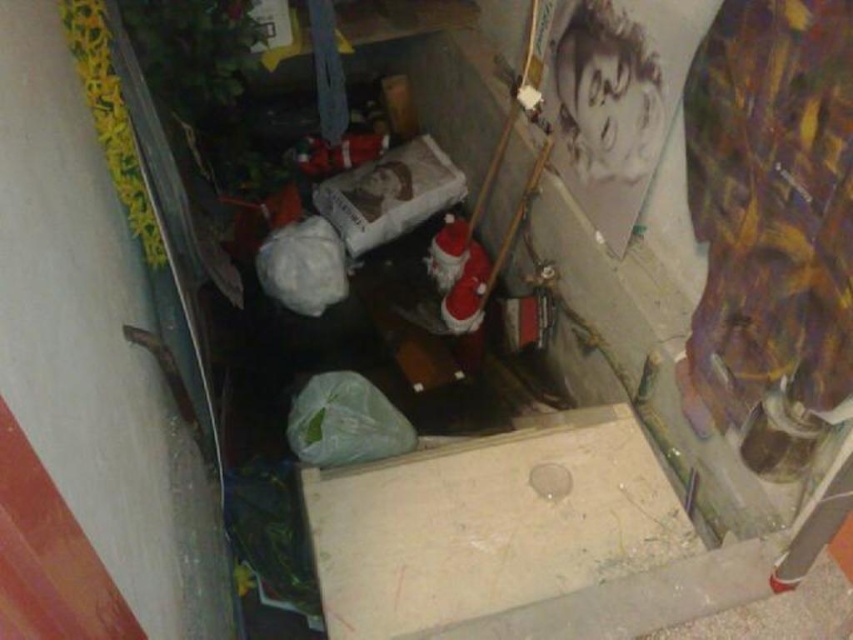
You are organizing items in the storage area and need to place a new item on the shelf. The shelf has limited space. Which object should you move to make room, the white matte plastic bag at center or the transparent plastic hole at center?

You should move the white matte plastic bag at center because the transparent plastic hole at center is behind it and might be part of the shelf structure, so moving the bag would free up space in front.

You are navigating through the storage area and need to reach a point that is closer to you. Which of the two points, point (x=303, y=241) or point (x=538, y=476), should you head towards?

Point (x=303, y=241) is closer to you than point (x=538, y=476), so you should head towards point (x=303, y=241).